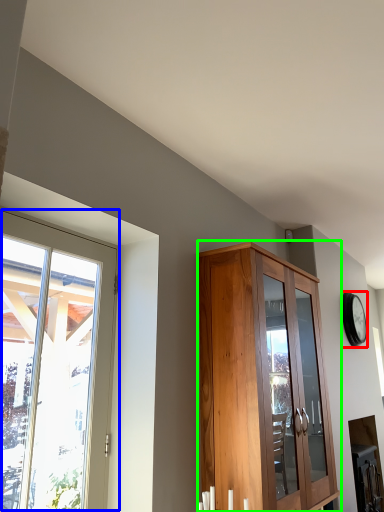
Question: Estimate the real-world distances between objects in this image. Which object is farther from clock (highlighted by a red box), window (highlighted by a blue box) or cupboard (highlighted by a green box)?

Choices:
 (A) window
 (B) cupboard

Answer: (A)